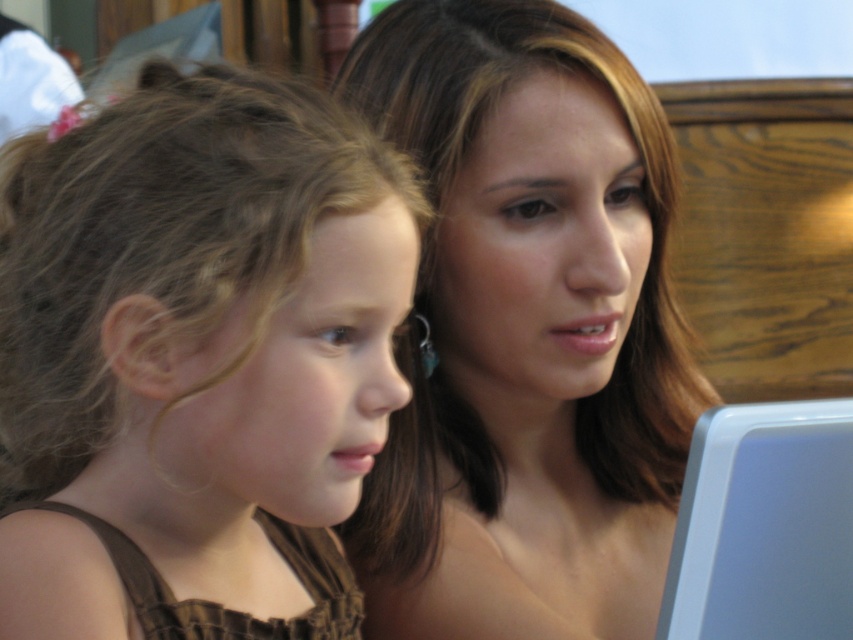
Question: Which point is closer to the camera?

Choices:
 (A) (758, 534)
 (B) (471, 477)
 (C) (287, 602)

Answer: (A)

Question: Observing the image, what is the correct spatial positioning of brown fabric dress at left in reference to matte skin tone at center?

Choices:
 (A) below
 (B) above

Answer: (A)

Question: Which of the following is the farthest from the observer?

Choices:
 (A) white plastic laptop at lower right
 (B) brown fabric dress at left
 (C) matte skin tone at center

Answer: (C)

Question: Is brown fabric dress at left thinner than white plastic laptop at lower right?

Choices:
 (A) no
 (B) yes

Answer: (A)

Question: Can you confirm if brown fabric dress at left is positioned below white plastic laptop at lower right?

Choices:
 (A) yes
 (B) no

Answer: (B)

Question: Which of the following is the closest to the observer?

Choices:
 (A) (822, 508)
 (B) (190, 627)
 (C) (590, 81)

Answer: (B)